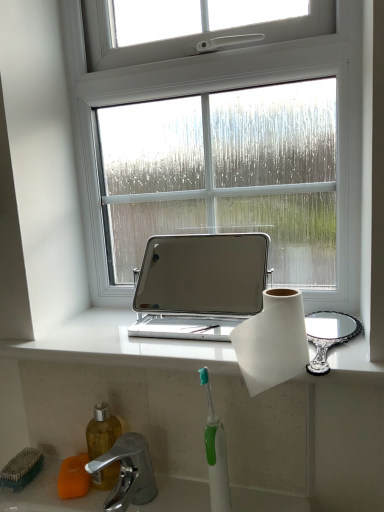
What do you see at coordinates (200, 285) in the screenshot?
I see `silver metallic laptop at center` at bounding box center [200, 285].

This screenshot has width=384, height=512. Describe the element at coordinates (128, 472) in the screenshot. I see `chrome metallic faucet at lower left` at that location.

This screenshot has width=384, height=512. What do you see at coordinates (216, 454) in the screenshot?
I see `green plastic toothbrush at lower center` at bounding box center [216, 454].

Where is `green bristle brush at lower left`? The height and width of the screenshot is (512, 384). green bristle brush at lower left is located at coordinates (21, 469).

This screenshot has height=512, width=384. Identify the location of silver metallic laptop at center. (x=200, y=285).

Considering the sizes of objects silver metallic laptop at center and green bristle brush at lower left in the image provided, who is wider, silver metallic laptop at center or green bristle brush at lower left?

Wider between the two is silver metallic laptop at center.

From the picture: From a real-world perspective, does silver metallic laptop at center sit lower than green bristle brush at lower left?

No, from a real-world perspective, silver metallic laptop at center is not below green bristle brush at lower left.

Image resolution: width=384 pixels, height=512 pixels. In the image, there is a green bristle brush at lower left. What are the coordinates of `laptop above it (from the image's perspective)` in the screenshot? It's located at click(200, 285).

Is silver metallic laptop at center aimed at green bristle brush at lower left?

No, silver metallic laptop at center is not aimed at green bristle brush at lower left.

Is chrome metallic faucet at lower left smaller than white paper at center?

Yes, chrome metallic faucet at lower left is smaller than white paper at center.

Consider the image. Which is more to the left, chrome metallic faucet at lower left or white paper at center?

chrome metallic faucet at lower left is more to the left.

Looking at their sizes, would you say chrome metallic faucet at lower left is wider or thinner than white paper at center?

Considering their sizes, chrome metallic faucet at lower left looks broader than white paper at center.

Is chrome metallic faucet at lower left further to camera compared to white paper at center?

Yes, it is behind white paper at center.

Considering the sizes of objects white paper at center and green plastic toothbrush at lower center in the image provided, who is taller, white paper at center or green plastic toothbrush at lower center?

green plastic toothbrush at lower center.

Is white paper at center bigger or smaller than green plastic toothbrush at lower center?

In the image, white paper at center appears to be larger than green plastic toothbrush at lower center.

Considering their positions, is white paper at center located in front of or behind green plastic toothbrush at lower center?

white paper at center is positioned closer to the viewer than green plastic toothbrush at lower center.

Can you tell me how much white paper at center and green plastic toothbrush at lower center differ in facing direction?

The angle between the facing direction of white paper at center and the facing direction of green plastic toothbrush at lower center is 0.0693 degrees.

From a real-world perspective, is white paper at center under orange sponge at lower left?

Incorrect, from a real-world perspective, white paper at center is higher than orange sponge at lower left.

Measure the distance from white paper at center to orange sponge at lower left.

A distance of 15.59 inches exists between white paper at center and orange sponge at lower left.

Would you say white paper at center is inside or outside orange sponge at lower left?

white paper at center cannot be found inside orange sponge at lower left.

Is white paper at center in contact with orange sponge at lower left?

No, white paper at center is not in contact with orange sponge at lower left.

From the image's perspective, is chrome metallic faucet at lower left above or below silver metallic laptop at center?

Clearly, from the image's perspective, chrome metallic faucet at lower left is below silver metallic laptop at center.

Visually, is chrome metallic faucet at lower left positioned to the left or to the right of silver metallic laptop at center?

chrome metallic faucet at lower left is to the left of silver metallic laptop at center.

Is chrome metallic faucet at lower left bigger than silver metallic laptop at center?

Actually, chrome metallic faucet at lower left might be smaller than silver metallic laptop at center.

Is chrome metallic faucet at lower left positioned with its back to green bristle brush at lower left?

No, chrome metallic faucet at lower left is not facing away from green bristle brush at lower left.

Are chrome metallic faucet at lower left and green bristle brush at lower left located far from each other?

Actually, chrome metallic faucet at lower left and green bristle brush at lower left are a little close together.

Who is bigger, chrome metallic faucet at lower left or green bristle brush at lower left?

chrome metallic faucet at lower left.

Based on the photo, is the position of chrome metallic faucet at lower left less distant than that of green bristle brush at lower left?

Yes, chrome metallic faucet at lower left is closer to the camera.

Which is in front, point (221, 475) or point (72, 462)?

The point (221, 475) is closer to the camera.

Is orange sponge at lower left a part of green plastic toothbrush at lower center?

That's incorrect, orange sponge at lower left is not inside green plastic toothbrush at lower center.

Considering the relative sizes of green plastic toothbrush at lower center and orange sponge at lower left in the image provided, is green plastic toothbrush at lower center shorter than orange sponge at lower left?

Incorrect, the height of green plastic toothbrush at lower center does not fall short of that of orange sponge at lower left.

From the image's perspective, is green plastic toothbrush at lower center located beneath orange sponge at lower left?

No.

Find the location of a particular element. brush lying below the silver metallic laptop at center (from the image's perspective) is located at coordinates [21, 469].

Locate an element on the screen. Image resolution: width=384 pixels, height=512 pixels. paper towel lying on the right of chrome metallic faucet at lower left is located at coordinates click(x=272, y=341).

Estimate the real-world distances between objects in this image. Which object is further from orange sponge at lower left, white marble window sill at center or green bristle brush at lower left?

white marble window sill at center is positioned further to the anchor orange sponge at lower left.

Considering their positions, is green plastic toothbrush at lower center positioned closer to green bristle brush at lower left than white paper at center?

green plastic toothbrush at lower center.

From the image, which object appears to be farther from silver metallic laptop at center, chrome metallic faucet at lower left or green bristle brush at lower left?

green bristle brush at lower left.

From the image, which object appears to be farther from white marble window sill at center, green bristle brush at lower left or green plastic toothbrush at lower center?

The object further to white marble window sill at center is green bristle brush at lower left.

When comparing their distances from white marble window sill at center, does green bristle brush at lower left or chrome metallic faucet at lower left seem closer?

The object closer to white marble window sill at center is chrome metallic faucet at lower left.

From the image, which object appears to be farther from white paper at center, green plastic toothbrush at lower center or white marble window sill at center?

white marble window sill at center.

Consider the image. From the image, which object appears to be nearer to green plastic toothbrush at lower center, white marble window sill at center or green bristle brush at lower left?

white marble window sill at center lies closer to green plastic toothbrush at lower center than the other object.

Based on their spatial positions, is white paper at center or green bristle brush at lower left closer to silver metallic laptop at center?

white paper at center.

Where is `toothbrush between silver metallic laptop at center and chrome metallic faucet at lower left in the up-down direction`? The image size is (384, 512). toothbrush between silver metallic laptop at center and chrome metallic faucet at lower left in the up-down direction is located at coordinates (216, 454).

Locate an element on the screen. Image resolution: width=384 pixels, height=512 pixels. toothbrush between white paper at center and chrome metallic faucet at lower left in the vertical direction is located at coordinates (216, 454).

Find the location of a particular element. The image size is (384, 512). laptop between green bristle brush at lower left and green plastic toothbrush at lower center from left to right is located at coordinates (200, 285).

Find the location of a particular element. tap between white marble window sill at center and orange sponge at lower left vertically is located at coordinates (128, 472).